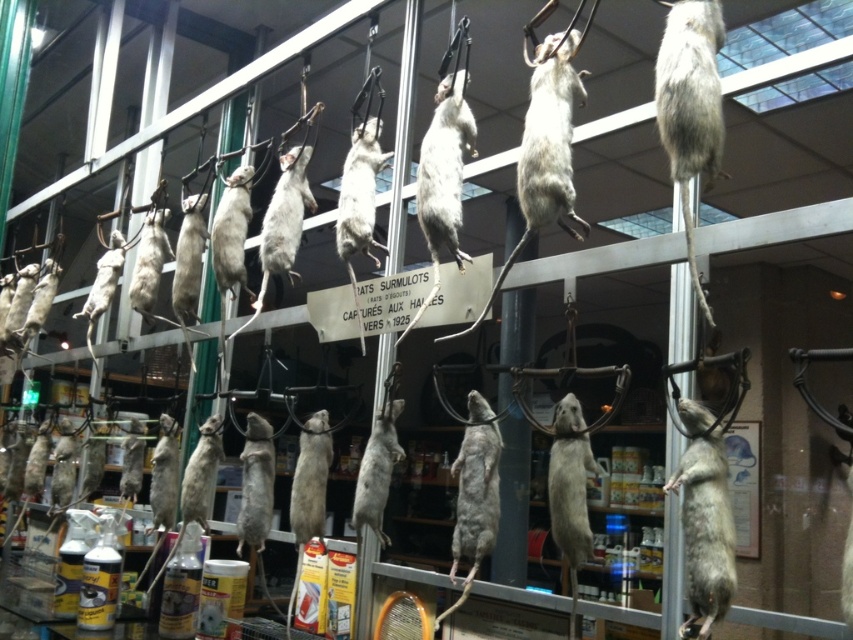
You are a customer in the store looking at the display of dead rats. You see the gray matte mouse at upper center and the fuzzy gray mouse at center. Which mouse is located to the right of the other?

The gray matte mouse at upper center is positioned on the right side of fuzzy gray mouse at center.

Looking at this image, you are a customer in the store looking at the display of dead rats. You notice two mice hanging from hooks at the center of the display. One is labeled as the fuzzy gray mouse at center and the other as the gray fur mouse at center. Which mouse is positioned higher in the display?

The fuzzy gray mouse at center is positioned higher than the gray fur mouse at center.